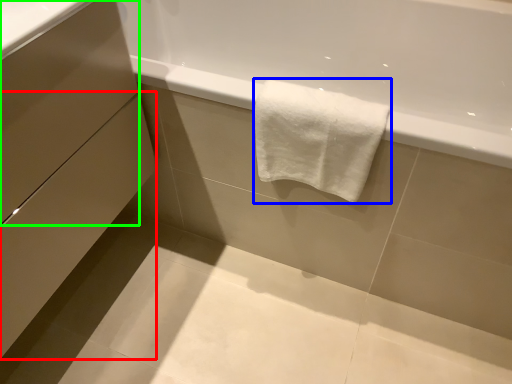
Question: Estimate the real-world distances between objects in this image. Which object is closer to drawer (highlighted by a red box), towel (highlighted by a blue box) or drawer (highlighted by a green box)?

Choices:
 (A) towel
 (B) drawer

Answer: (B)